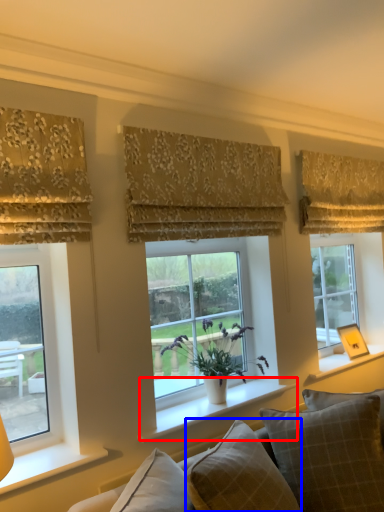
Question: Which object appears farthest to the camera in this image, window sill (highlighted by a red box) or pillow (highlighted by a blue box)?

Choices:
 (A) window sill
 (B) pillow

Answer: (A)